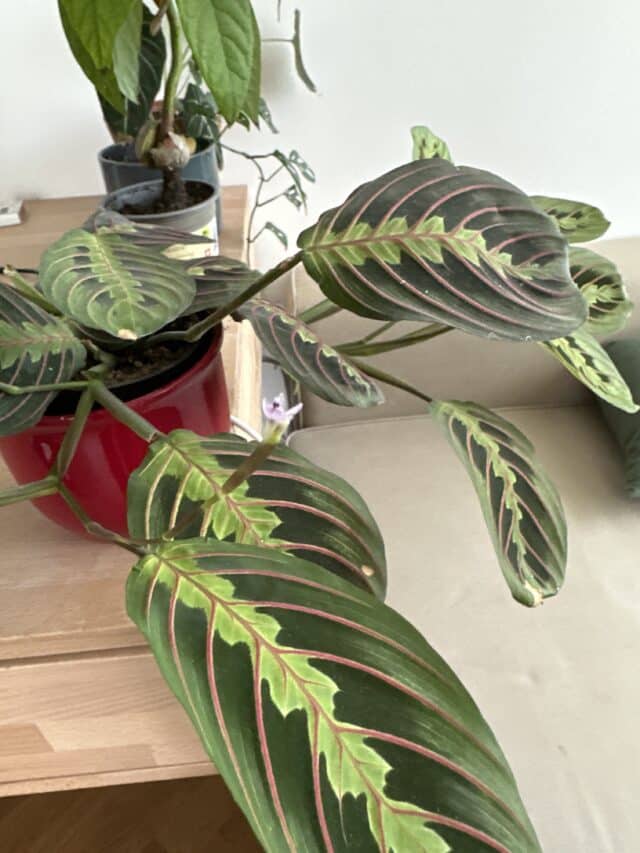
Identify the location of fabric. (576, 611), (624, 351).